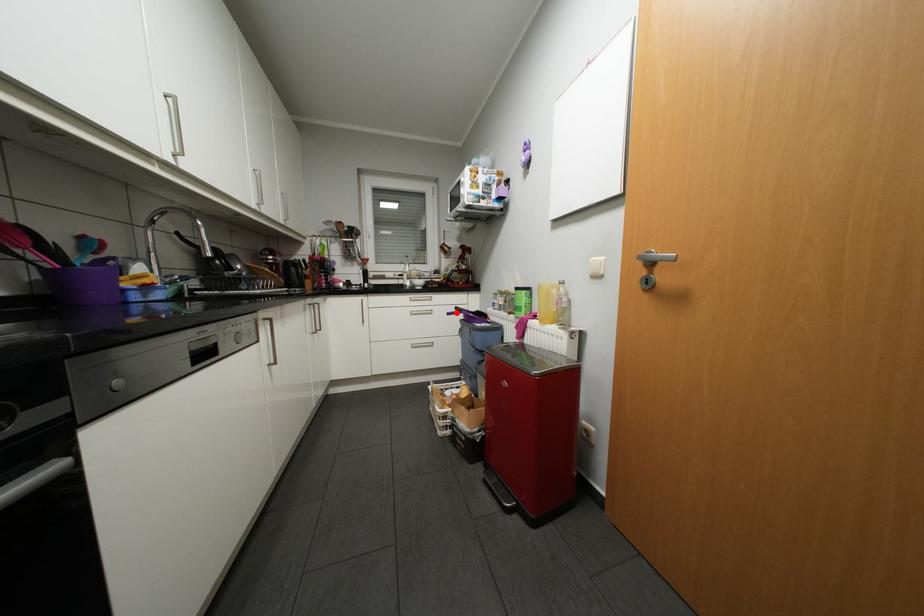
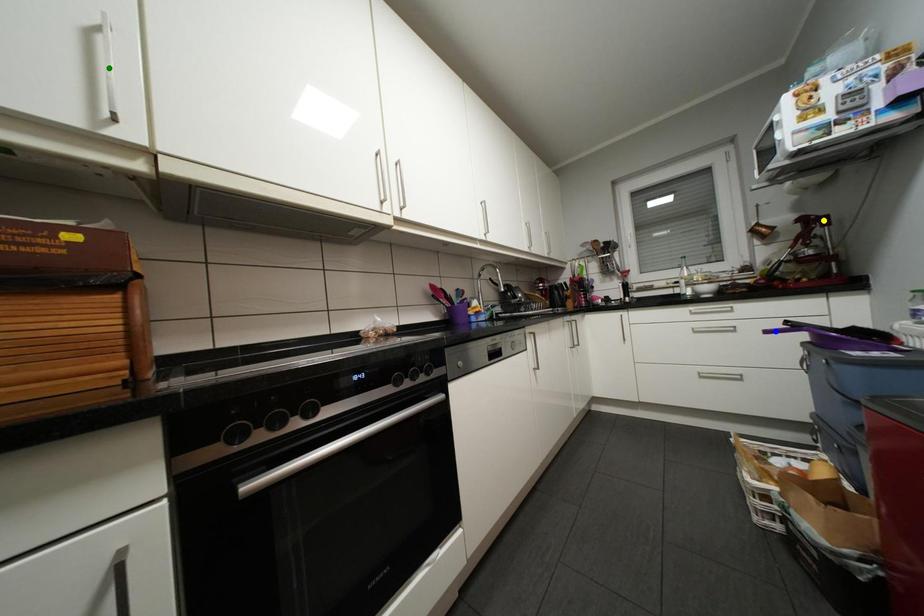
Question: I am providing you with two images of the same scene from different viewpoints. A red point is marked on the first image. You are given multiple points on the second image. Which point in image 2 represents the same 3d spot as the red point in image 1?

Choices:
 (A) yellow point
 (B) green point
 (C) blue point

Answer: (C)